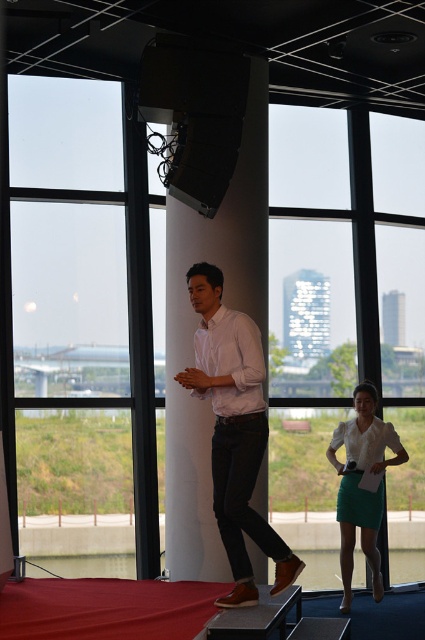
Does white glossy pillar at center have a greater height compared to white shirt at center?

Correct, white glossy pillar at center is much taller as white shirt at center.

Is white glossy pillar at center to the right of white shirt at center from the viewer's perspective?

No, white glossy pillar at center is not to the right of white shirt at center.

Is point (180, 422) less distant than point (258, 384)?

No, (180, 422) is behind (258, 384).

You are a GUI agent. You are given a task and a screenshot of the screen. Output one action in this format:
    pyautogui.click(x=<x>, y=<y>)
    Task: Click on the white glossy pillar at center
    The width and height of the screenshot is (425, 640).
    Given the screenshot: What is the action you would take?
    pyautogui.click(x=195, y=326)

How distant is white shirt at center from matte white blouse at center?

white shirt at center and matte white blouse at center are 2.56 meters apart from each other.

Can you confirm if white shirt at center is wider than matte white blouse at center?

Yes.

Describe the element at coordinates (235, 429) in the screenshot. This screenshot has height=640, width=425. I see `white shirt at center` at that location.

The image size is (425, 640). In order to click on white shirt at center in this screenshot , I will do `click(235, 429)`.

Between point (261, 332) and point (360, 417), which one is positioned in front?

Positioned in front is point (261, 332).

Is white glossy pillar at center in front of matte white blouse at center?

Yes, white glossy pillar at center is in front of matte white blouse at center.

Is point (251, 115) more distant than point (404, 458)?

No, (251, 115) is closer to viewer.

The image size is (425, 640). Identify the location of white glossy pillar at center. (195, 326).